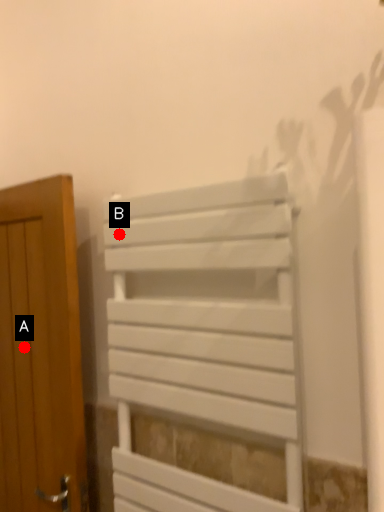
Question: Two points are circled on the image, labeled by A and B beside each circle. Which point is closer to the camera?

Choices:
 (A) A is closer
 (B) B is closer

Answer: (B)